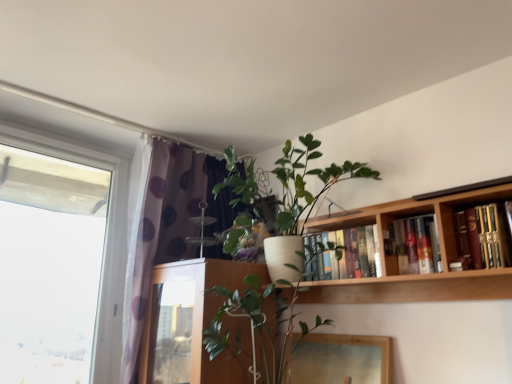
Question: Considering the relative sizes of purple dotted fabric at left and hardcover books at upper right, marked as the second book in a left-to-right arrangement, in the image provided, is purple dotted fabric at left bigger than hardcover books at upper right, marked as the second book in a left-to-right arrangement,?

Choices:
 (A) yes
 (B) no

Answer: (A)

Question: From a real-world perspective, does purple dotted fabric at left sit lower than hardcover books at upper right, the second book viewed from the back?

Choices:
 (A) no
 (B) yes

Answer: (A)

Question: Is purple dotted fabric at left wider than hardcover books at upper right, the second book viewed from the back?

Choices:
 (A) yes
 (B) no

Answer: (A)

Question: From the image's perspective, is purple dotted fabric at left beneath hardcover books at upper right, positioned as the 2th book in front-to-back order?

Choices:
 (A) yes
 (B) no

Answer: (A)

Question: Is purple dotted fabric at left closer to the viewer compared to hardcover books at upper right, the 2th book viewed from the right?

Choices:
 (A) yes
 (B) no

Answer: (B)

Question: Is purple dotted fabric at left next to hardcover books at upper right, marked as the second book in a left-to-right arrangement, and touching it?

Choices:
 (A) yes
 (B) no

Answer: (B)

Question: Is transparent glass window at left looking in the opposite direction of hardcover books at upper center, acting as the 1th book starting from the left?

Choices:
 (A) no
 (B) yes

Answer: (A)

Question: Is transparent glass window at left not near hardcover books at upper center, acting as the 1th book starting from the left?

Choices:
 (A) no
 (B) yes

Answer: (B)

Question: Is transparent glass window at left positioned before hardcover books at upper center, acting as the 1th book starting from the left?

Choices:
 (A) no
 (B) yes

Answer: (B)

Question: From the image's perspective, is transparent glass window at left on hardcover books at upper center, which appears as the third book when viewed from the right?

Choices:
 (A) no
 (B) yes

Answer: (A)

Question: Is transparent glass window at left beside hardcover books at upper center, which appears as the 1th book when viewed from the back?

Choices:
 (A) no
 (B) yes

Answer: (A)

Question: From the image's perspective, would you say transparent glass window at left is shown under hardcover books at upper center, which appears as the 1th book when viewed from the back?

Choices:
 (A) yes
 (B) no

Answer: (A)

Question: From a real-world perspective, is purple dotted fabric at left under wooden bookshelf at upper right?

Choices:
 (A) no
 (B) yes

Answer: (A)